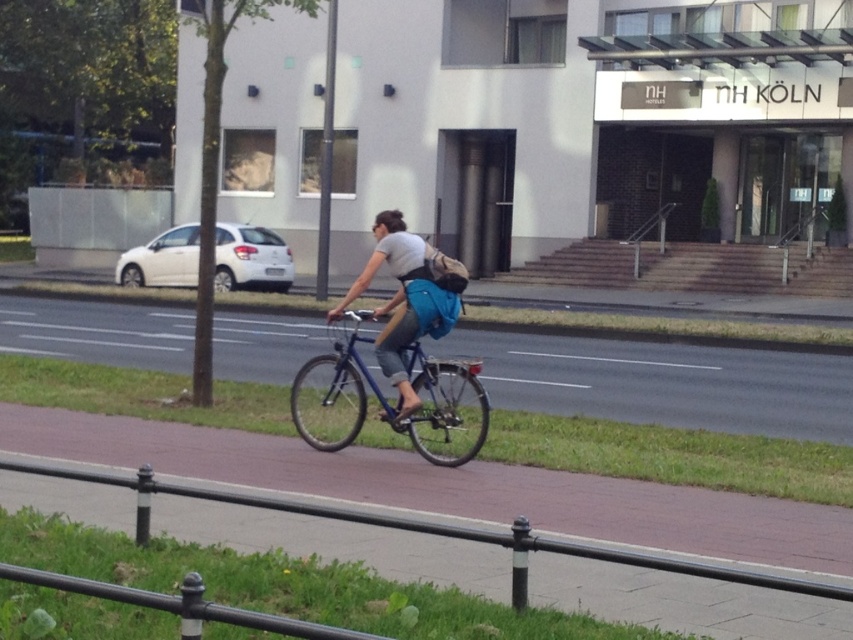
You are a delivery drone operator. You need to deliver a package to the blue fabric backpack at center. The delivery zone is a circular area with a radius of 0.1 units centered at point (408, 298). Can you confirm if the blue fabric backpack at center is within the delivery zone?

Yes, the blue fabric backpack at center is exactly at point (408, 298), which is the center of the delivery zone, so it is within the delivery zone.